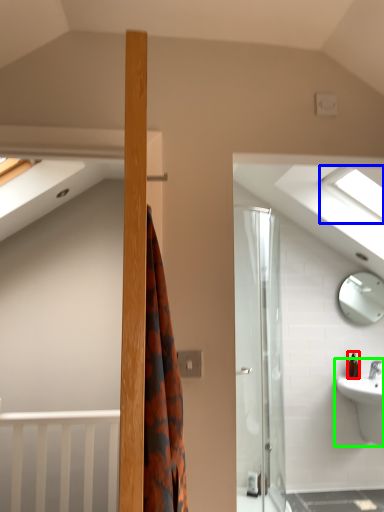
Question: Based on their relative distances, which object is nearer to toiletry (highlighted by a red box)? Choose from window (highlighted by a blue box) and sink (highlighted by a green box).

Choices:
 (A) window
 (B) sink

Answer: (B)